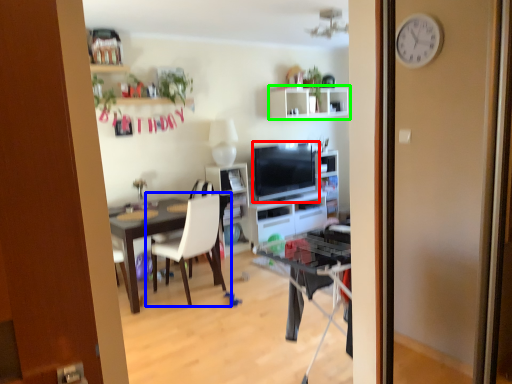
Question: Which object is positioned closest to television (highlighted by a red box)? Select from chair (highlighted by a blue box) and shelf (highlighted by a green box).

Choices:
 (A) chair
 (B) shelf

Answer: (B)